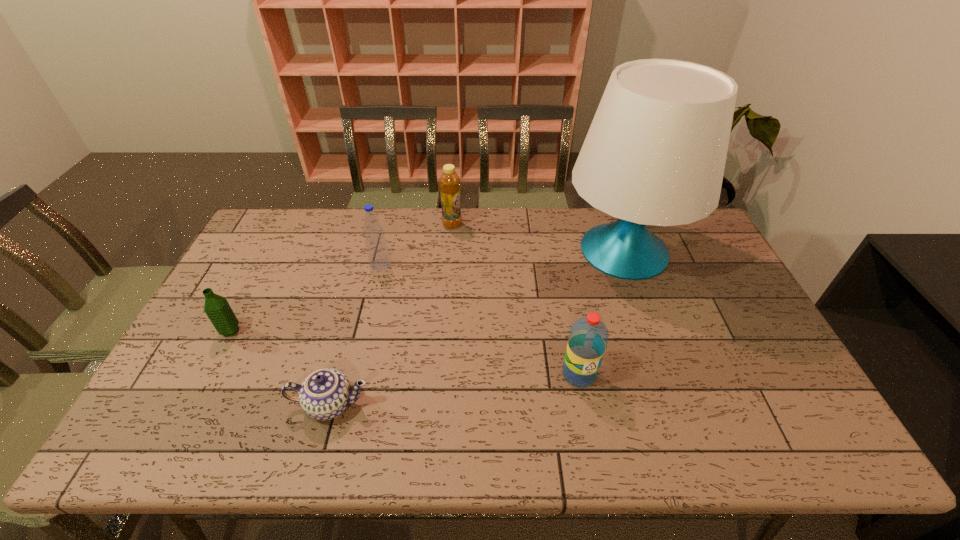
Find the location of `vacant area situated on the left of the bottle`. vacant area situated on the left of the bottle is located at coordinates (375, 225).

Image resolution: width=960 pixels, height=540 pixels. In order to click on free space located on the front of the second water bottle from right to left in this screenshot , I will do `click(353, 376)`.

Find the location of a particular element. This screenshot has width=960, height=540. free space located 0.050m on the front label of the rightmost water bottle is located at coordinates (586, 407).

Find the location of `blank space located 0.320m on the right of the leftmost water bottle`. blank space located 0.320m on the right of the leftmost water bottle is located at coordinates (354, 331).

Identify the location of table lamp that is at the far edge. (655, 153).

You are a GUI agent. You are given a task and a screenshot of the screen. Output one action in this format:
    pyautogui.click(x=<x>, y=<y>)
    Task: Click on the bottle positioned at the far edge
    
    Given the screenshot: What is the action you would take?
    pyautogui.click(x=449, y=183)

Find the location of a particular element. The image size is (960, 540). object that is at the near edge is located at coordinates (325, 394).

I want to click on object located in the left edge section of the desktop, so click(218, 310).

Identify the location of object present at the right edge. This screenshot has width=960, height=540. (655, 153).

Image resolution: width=960 pixels, height=540 pixels. I want to click on object located in the far right corner section of the desktop, so click(655, 153).